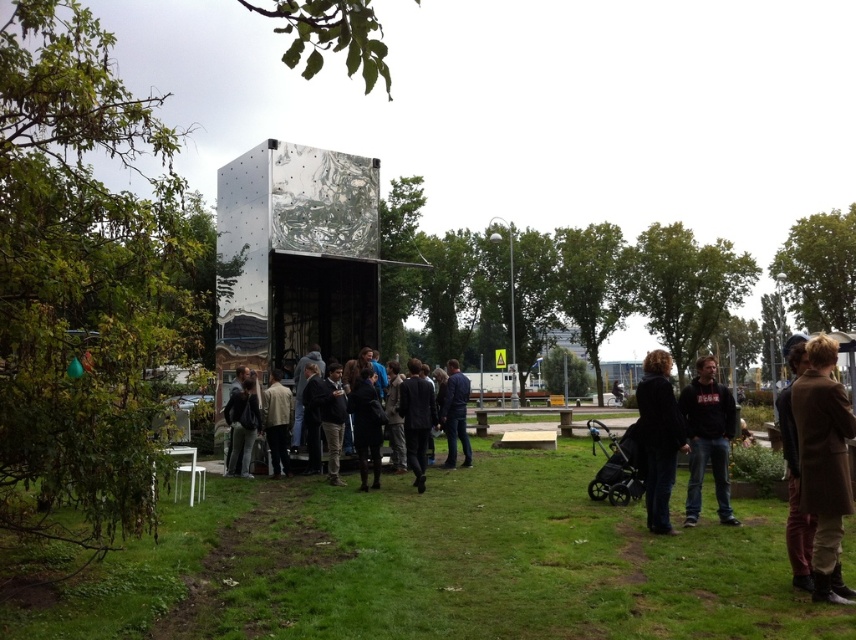
You are standing at point (435, 564) in the park. What is the terrain like at that location?

The terrain at point (435, 564) is green grass at center.

You are standing at the origin point in the image. Which direction should you move to reach the green grass at center?

The green grass at center is located at point 0.883 on the x axis and 0.509 on the y axis. Since you are at the origin, you should move towards the right and slightly upwards to reach the green grass at center.